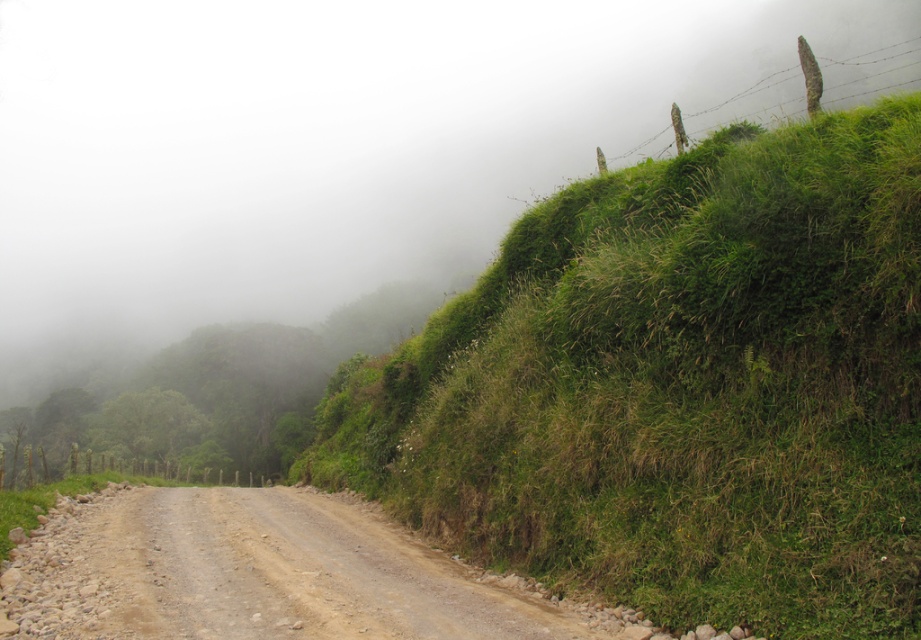
You are driving a truck that is 2.5 meters tall. You need to pass under the green grassy hillside at upper right and the dusty gravel road at center. Can your truck safely pass under both without hitting anything?

The green grassy hillside at upper right is much taller than the dusty gravel road at center. Since the truck is 2.5 meters tall, it can safely pass under both as long as the height of the dusty gravel road at center is sufficient. However, without specific measurements for the road, we cannot confirm. Please check the actual clearance.

You are driving a truck with a height of 2 meters. You need to pass under the green grassy hillside at upper right and the dusty gravel road at center. Which object might you hit your truck on if you proceed?

The green grassy hillside at upper right is above the dusty gravel road at center, so the truck might hit the green grassy hillside at upper right if it is too tall.

You are a hiker planning to cross the green grassy hillside at upper right and the dusty gravel road at center. Which path would you choose if you want to cover more ground with fewer steps?

The green grassy hillside at upper right has a larger size compared to the dusty gravel road at center, so choosing it would allow you to cover more ground with fewer steps.